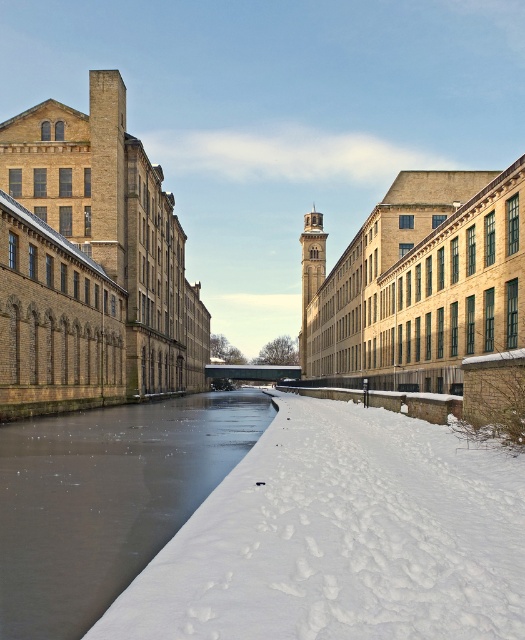
You are standing at the center of the canal looking towards the buildings. There are two points marked on the image. Which point, point (x=410, y=596) or point (x=21, y=554), is closer to you?

Point (x=410, y=596) is closer to the viewer than point (x=21, y=554).

You are standing at the edge of the canal and want to walk to the snow area. Which direction should you move to reach the white fluffy snow at lower right without stepping on the frozen ice at center?

You should move towards the lower right direction to reach the white fluffy snow at lower right since it is in front of the frozen ice at center, meaning it is closer to your current position at the edge of the canal.